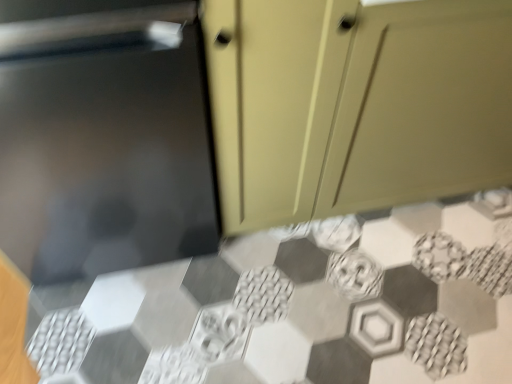
Question: Should I look upward or downward to see matte beige cabinet at upper right?

Choices:
 (A) down
 (B) up

Answer: (B)

Question: Is matte beige cabinet at upper right inside hexagonal mosaic tile at center?

Choices:
 (A) yes
 (B) no

Answer: (B)

Question: From a real-world perspective, is hexagonal mosaic tile at center physically below matte beige cabinet at upper right?

Choices:
 (A) no
 (B) yes

Answer: (B)

Question: From the image's perspective, would you say hexagonal mosaic tile at center is shown under matte beige cabinet at upper right?

Choices:
 (A) yes
 (B) no

Answer: (A)

Question: Does hexagonal mosaic tile at center have a lesser width compared to matte beige cabinet at upper right?

Choices:
 (A) no
 (B) yes

Answer: (A)

Question: Is hexagonal mosaic tile at center shorter than matte beige cabinet at upper right?

Choices:
 (A) yes
 (B) no

Answer: (A)

Question: Does hexagonal mosaic tile at center come in front of matte beige cabinet at upper right?

Choices:
 (A) yes
 (B) no

Answer: (B)

Question: Does matte beige cabinet at upper right have a smaller size compared to hexagonal mosaic tile at center?

Choices:
 (A) no
 (B) yes

Answer: (A)

Question: From a real-world perspective, is matte beige cabinet at upper right on hexagonal mosaic tile at center?

Choices:
 (A) yes
 (B) no

Answer: (A)

Question: Considering the relative sizes of matte beige cabinet at upper right and hexagonal mosaic tile at center in the image provided, is matte beige cabinet at upper right thinner than hexagonal mosaic tile at center?

Choices:
 (A) yes
 (B) no

Answer: (A)

Question: Considering the relative positions of matte beige cabinet at upper right and hexagonal mosaic tile at center in the image provided, is matte beige cabinet at upper right to the right of hexagonal mosaic tile at center from the viewer's perspective?

Choices:
 (A) no
 (B) yes

Answer: (B)

Question: Does matte beige cabinet at upper right have a greater height compared to hexagonal mosaic tile at center?

Choices:
 (A) no
 (B) yes

Answer: (B)

Question: Is matte beige cabinet at upper right located outside hexagonal mosaic tile at center?

Choices:
 (A) yes
 (B) no

Answer: (A)

Question: In terms of size, does hexagonal mosaic tile at center appear bigger or smaller than matte beige cabinet at upper right?

Choices:
 (A) big
 (B) small

Answer: (B)